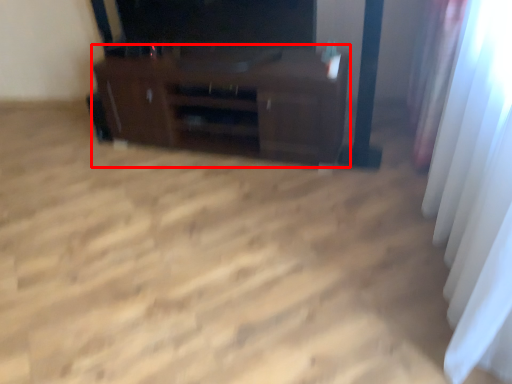
Question: From the image's perspective, what is the correct spatial positioning of furniture (annotated by the red box) in reference to curtain?

Choices:
 (A) below
 (B) above

Answer: (B)